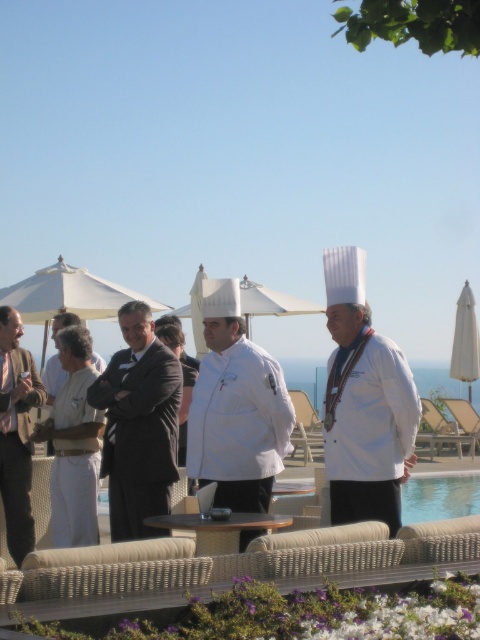
Question: Based on their relative distances, which object is farther from the white fabric apron at left?

Choices:
 (A) white chef's coat at left
 (B) white chef hat at right

Answer: (B)

Question: Which object appears farthest from the camera in this image?

Choices:
 (A) white fabric apron at left
 (B) white chef's coat at left
 (C) white fabric umbrella at right
 (D) smokey gray suit at center

Answer: (C)

Question: Does white chef's coat at left come behind white fabric umbrella at right?

Choices:
 (A) yes
 (B) no

Answer: (B)

Question: Which point appears closest to the camera in this image?

Choices:
 (A) (116, 429)
 (B) (55, 365)
 (C) (408, 384)
 (D) (276, 429)

Answer: (C)

Question: Does white fabric umbrella at right have a larger size compared to white fabric apron at left?

Choices:
 (A) yes
 (B) no

Answer: (A)

Question: Where is white matte chef coat at center located in relation to white fabric apron at left in the image?

Choices:
 (A) right
 (B) left

Answer: (A)